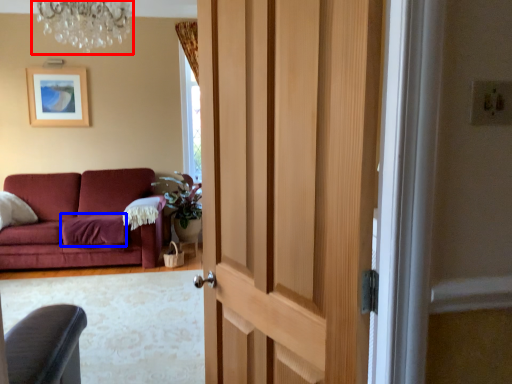
Question: Which object appears closest to the camera in this image, light fixture (highlighted by a red box) or blanket (highlighted by a blue box)?

Choices:
 (A) light fixture
 (B) blanket

Answer: (A)